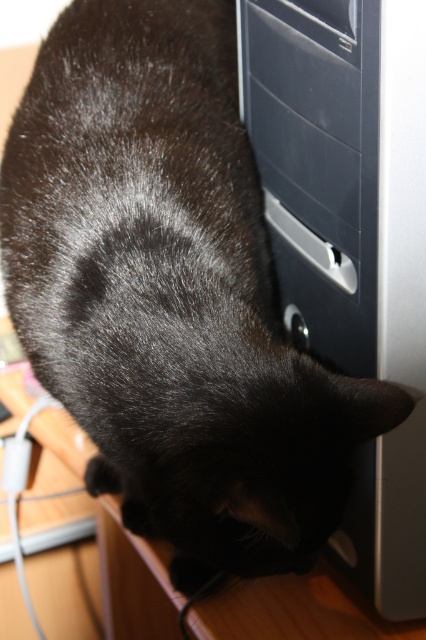
You are organizing a desk and need to place a small plant between the satin silver computer tower at center and the satin black drawer at center. Since the plant requires a stable base, which object should you place the plant closer to based on their heights?

The satin silver computer tower at center is taller than the satin black drawer at center, so placing the plant closer to the satin black drawer at center would provide a more stable base due to its lower height.

You are a photographer trying to capture a closeup of the black cat in the scene. You notice two points of interest marked as point 1 at coordinates point (291, 256) and point 2 at coordinates point (316, 122). Which point should you focus on to ensure the cat is in sharp focus?

Point 1 at coordinates point (291, 256) is further to the camera than point 2 at coordinates point (316, 122). To ensure the cat is in sharp focus, you should focus on point 1 at coordinates point (291, 256) since it is closer to the camera.

You are standing in front of the computer tower where the black cat is leaning. You want to place a small toy mouse exactly at the point marked as point (239, 1). If your hand is currently 1 meter away from the computer tower, can you reach the point without moving closer?

The distance between you and point (239, 1) is 93.89 centimeters. Since your hand is 1 meter away from the computer tower, you can reach the point without moving closer because 93.89 cm is less than 1 meter.